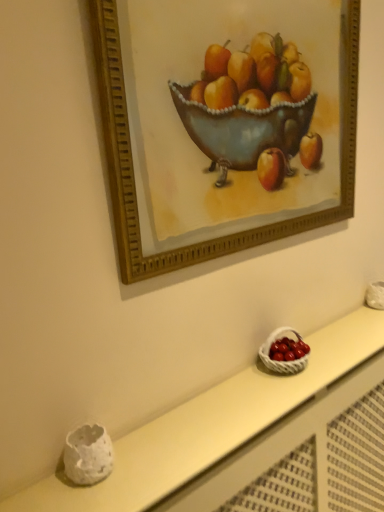
Question: From a real-world perspective, relative to gold-framed picture at upper center, is white wicker basket at lower right vertically above or below?

Choices:
 (A) below
 (B) above

Answer: (A)

Question: Considering the relative positions of white wicker basket at lower right and gold-framed picture at upper center in the image provided, is white wicker basket at lower right to the left or to the right of gold-framed picture at upper center?

Choices:
 (A) right
 (B) left

Answer: (A)

Question: Estimate the real-world distances between objects in this image. Which object is farther from the white wicker basket at lower right?

Choices:
 (A) white wicker basket at lower right
 (B) gold-framed picture at upper center

Answer: (B)

Question: Which is nearer to the white wicker basket at lower right?

Choices:
 (A) gold-framed picture at upper center
 (B) white wicker basket at lower right

Answer: (B)